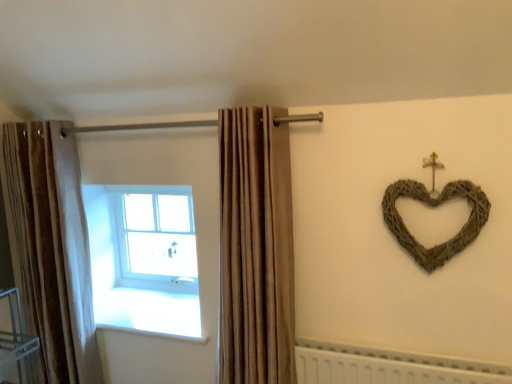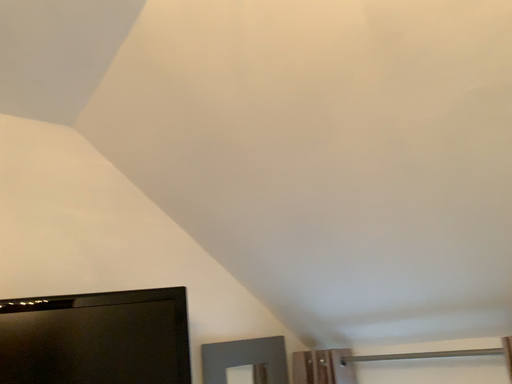
Question: How did the camera likely rotate when shooting the video?

Choices:
 (A) rotated right
 (B) rotated left

Answer: (B)